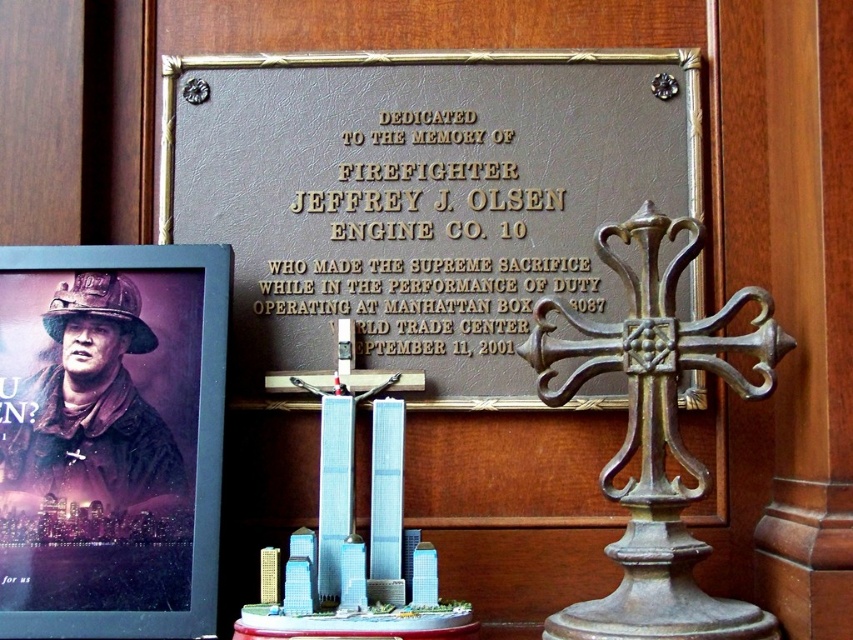
You are standing in front of the memorial and want to know which object is taller between the brown leather plaque at center and the matte black poster at left. Can you tell me?

The brown leather plaque at center is taller than the matte black poster at left.

You are an event organizer setting up a memorial display. You have two items to place on a table. The brown leather plaque at center and the matte black poster at left. Which item should you place in a more prominent position to ensure it is easily visible to visitors?

The brown leather plaque at center should be placed in a more prominent position since it is larger in size compared to the matte black poster at left, making it more noticeable to visitors.